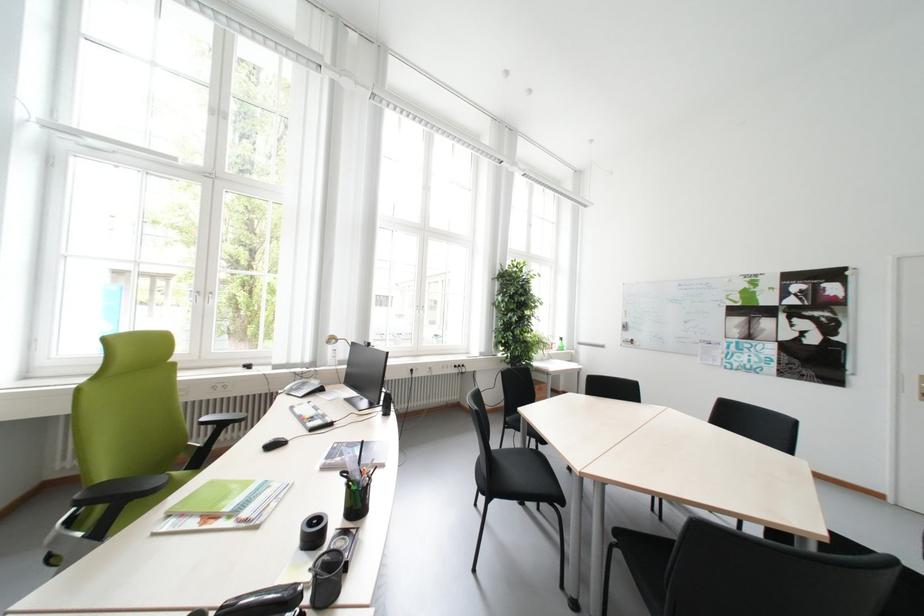
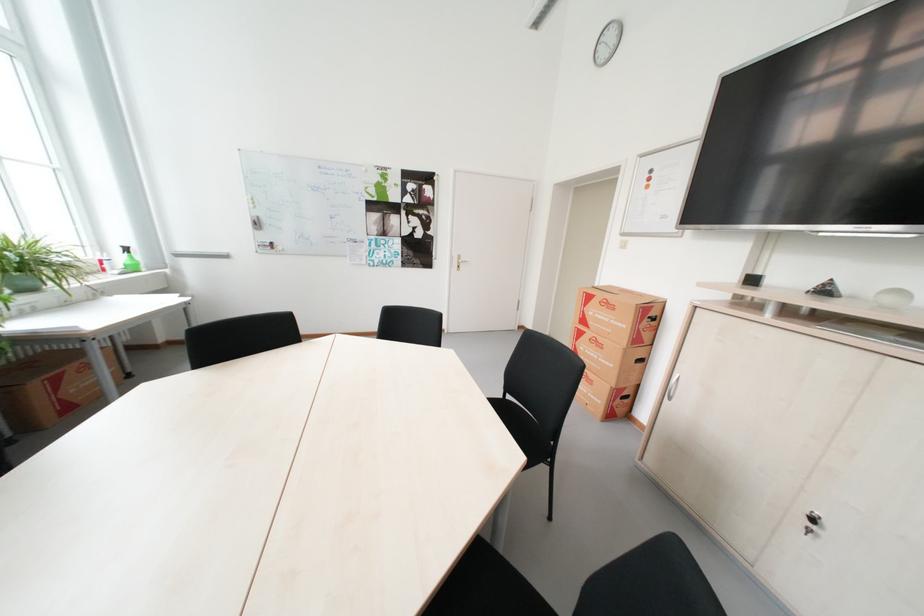
The point at (567, 344) is marked in the first image. Where is the corresponding point in the second image?

(130, 260)